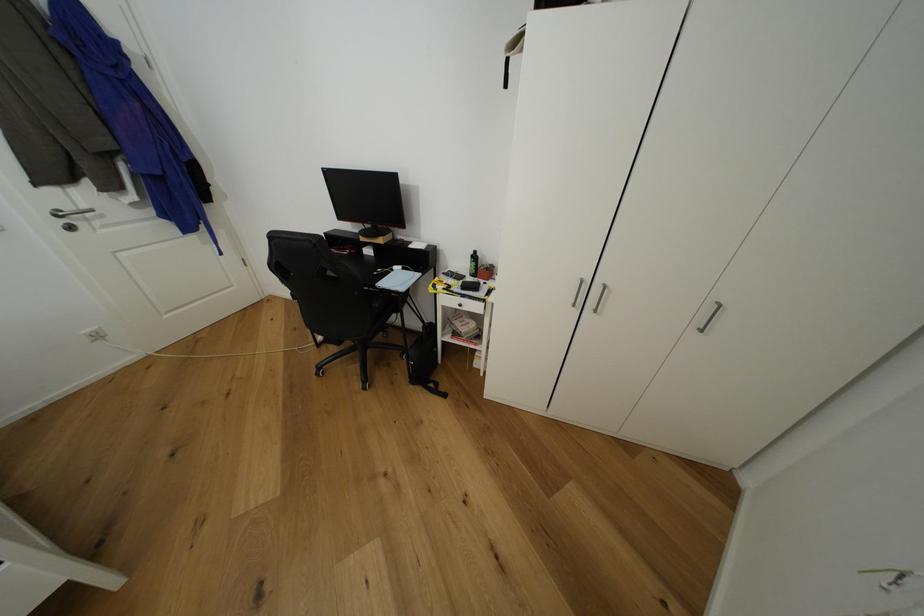
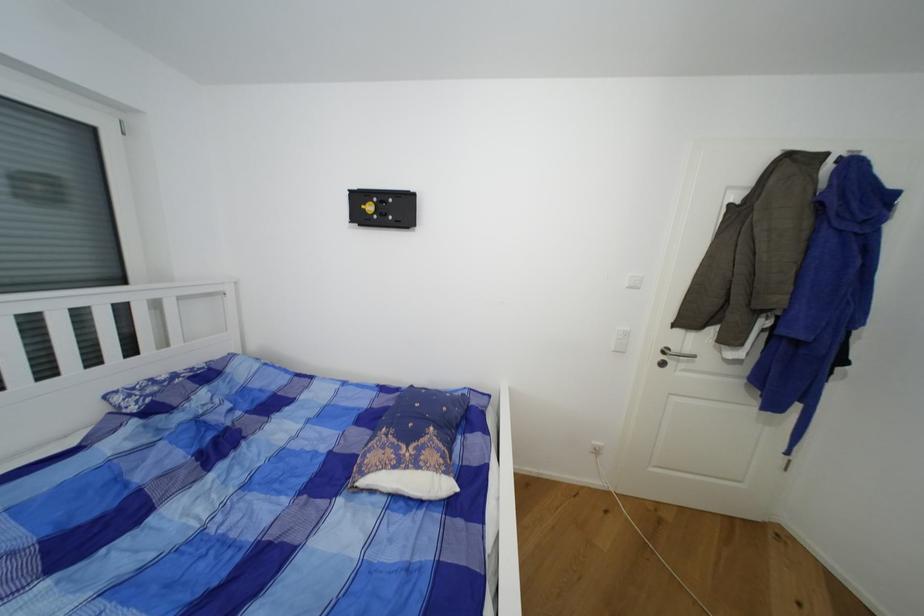
In the second image, find the point that corresponds to the point at 90,209 in the first image.

(691, 352)